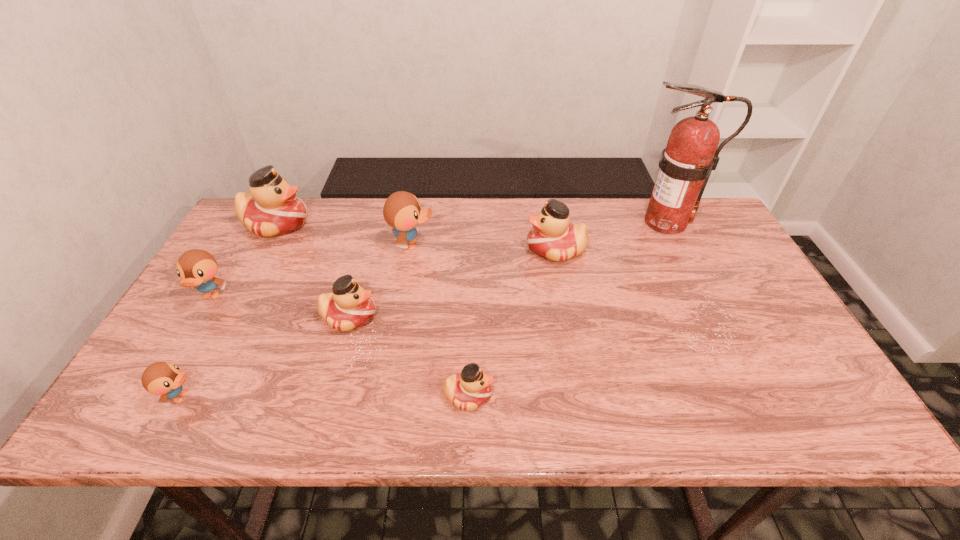
Where is `the nearest blue duck`? the nearest blue duck is located at coordinates (161, 378).

Locate an element on the screen. The height and width of the screenshot is (540, 960). the nearest red duck is located at coordinates (471, 388).

You are a GUI agent. You are given a task and a screenshot of the screen. Output one action in this format:
    pyautogui.click(x=<x>, y=<y>)
    Task: Click on the smallest red duck
    Image resolution: width=960 pixels, height=540 pixels.
    Given the screenshot: What is the action you would take?
    pyautogui.click(x=471, y=388)

I want to click on blank space located 0.260m at the nozzle of the rightmost object, so click(544, 222).

Locate an element on the screen. Image resolution: width=960 pixels, height=540 pixels. vacant area situated at the nozzle of the rightmost object is located at coordinates (607, 222).

This screenshot has width=960, height=540. I want to click on free location located 0.150m at the nozzle of the rightmost object, so click(x=579, y=222).

What are the coordinates of `vacant point located on the face of the biggest red duck` in the screenshot? It's located at click(420, 224).

Where is `vacant area situated 0.350m on the front-facing side of the farthest blue duck`? The width and height of the screenshot is (960, 540). vacant area situated 0.350m on the front-facing side of the farthest blue duck is located at coordinates (551, 245).

Locate an element on the screen. This screenshot has height=540, width=960. vacant area located 0.330m on the face of the rightmost duck is located at coordinates (415, 249).

Identify the location of vacant position located 0.090m on the face of the rightmost duck. (495, 249).